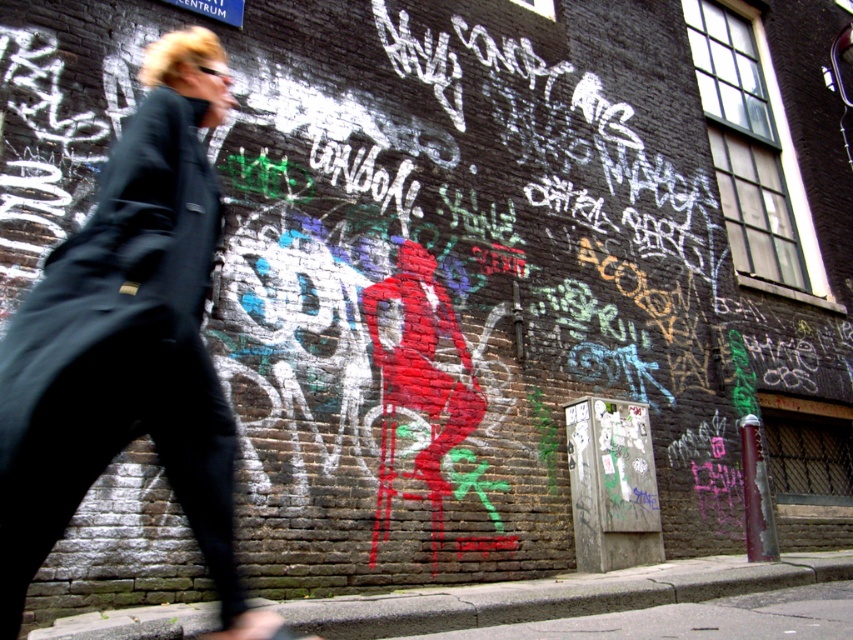
Can you confirm if matte black coat at left is taller than concrete sidewalk at lower center?

Correct, matte black coat at left is much taller as concrete sidewalk at lower center.

Can you confirm if matte black coat at left is positioned to the left of concrete sidewalk at lower center?

Indeed, matte black coat at left is positioned on the left side of concrete sidewalk at lower center.

Between point (57, 436) and point (36, 634), which one is positioned in front?

Point (57, 436)

At what (x,y) coordinates should I click in order to perform the action: click on matte black coat at left. Please return your answer as a coordinate pair (x, y). This screenshot has width=853, height=640. Looking at the image, I should click on (128, 340).